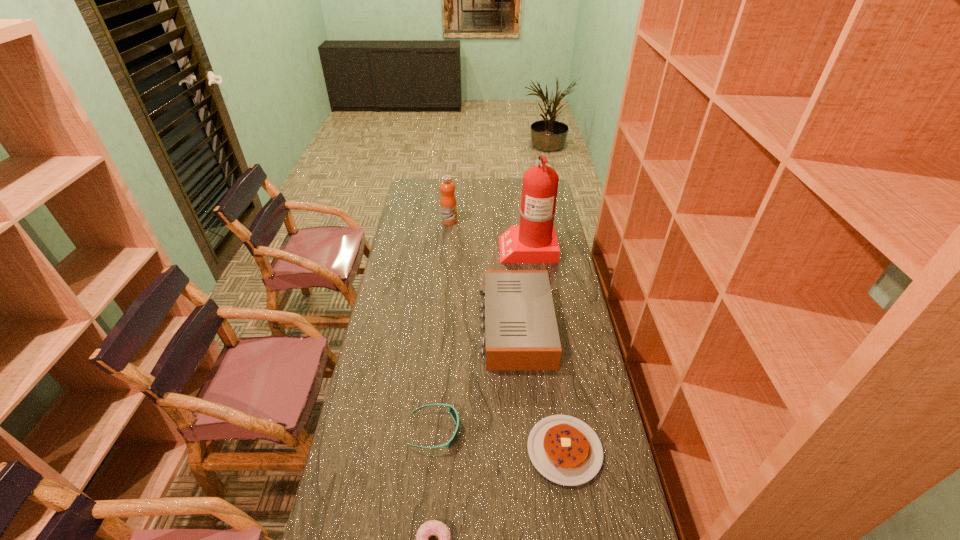
At what (x,y) coordinates should I click in order to perform the action: click on free space at the far edge. Please return your answer as a coordinate pair (x, y). The height and width of the screenshot is (540, 960). Looking at the image, I should click on (488, 185).

Where is `vacant space at the left edge of the desktop`? This screenshot has height=540, width=960. vacant space at the left edge of the desktop is located at coordinates (348, 458).

Image resolution: width=960 pixels, height=540 pixels. I want to click on vacant space at the right edge, so click(x=597, y=397).

I want to click on vacant space at the far left corner of the desktop, so click(435, 193).

Locate an element on the screen. The width and height of the screenshot is (960, 540). free space between the fourth nearest object and the pancake is located at coordinates (540, 388).

Where is `free space that is in between the sunglasses and the second farthest object`? The width and height of the screenshot is (960, 540). free space that is in between the sunglasses and the second farthest object is located at coordinates (481, 339).

Locate an element on the screen. This screenshot has width=960, height=540. vacant area between the sunglasses and the farthest object is located at coordinates (442, 326).

Identify the location of free space that is in between the sunglasses and the farthest object. The image size is (960, 540). (442, 326).

Identify the location of vacant space that is in between the pancake and the radio receiver. The image size is (960, 540). (540, 388).

You are a GUI agent. You are given a task and a screenshot of the screen. Output one action in this format:
    pyautogui.click(x=<x>, y=<y>)
    Task: Click on the empty location between the sunglasses and the tallest object
    This screenshot has height=540, width=960.
    Given the screenshot: What is the action you would take?
    pyautogui.click(x=481, y=339)